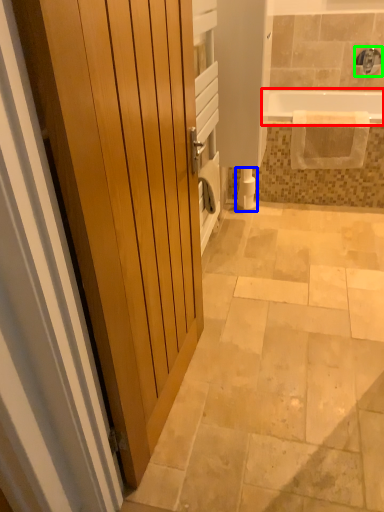
Question: Which object is positioned farthest from bathtub (highlighted by a red box)? Select from toilet paper (highlighted by a blue box) and faucet (highlighted by a green box).

Choices:
 (A) toilet paper
 (B) faucet

Answer: (A)